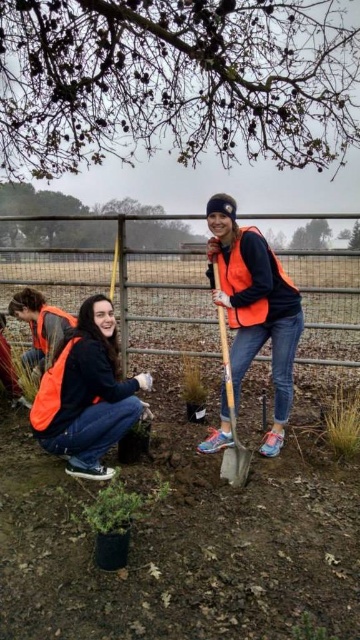
Based on the provided scene description, where is the smooth bark tree at upper center located in the image?

The smooth bark tree at upper center is located at the 2D coordinates point (174, 81) in the image.

You are part of a tree planting team and need to place a marker at the base of the smooth bark tree at upper center. The marker must be placed below the orange reflective vest at center. Is this possible based on the current arrangement?

The smooth bark tree at upper center is located above the orange reflective vest at center, so placing the marker below the orange reflective vest at center would be possible since the tree is positioned higher up.